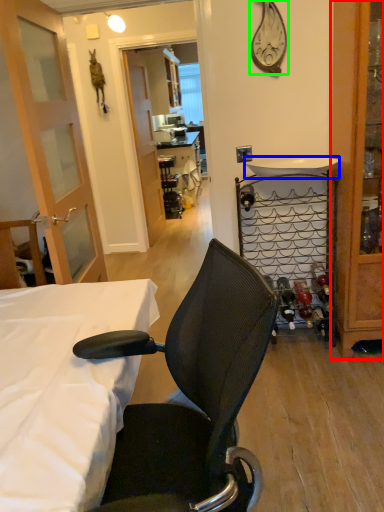
Question: Based on their relative distances, which object is farther from cabinetry (highlighted by a red box)? Choose from sink (highlighted by a blue box) and clock (highlighted by a green box).

Choices:
 (A) sink
 (B) clock

Answer: (B)